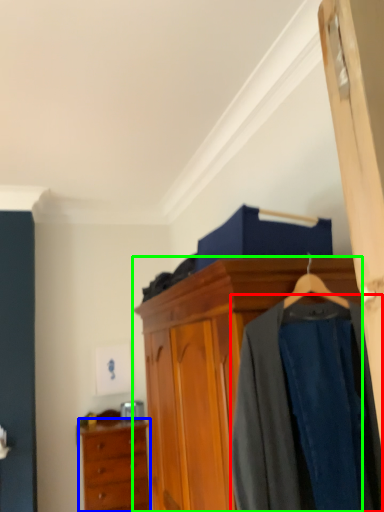
Question: Considering the real-world distances, which object is farthest from clothing (highlighted by a red box)? chest of drawers (highlighted by a blue box) or cabinetry (highlighted by a green box)?

Choices:
 (A) chest of drawers
 (B) cabinetry

Answer: (A)